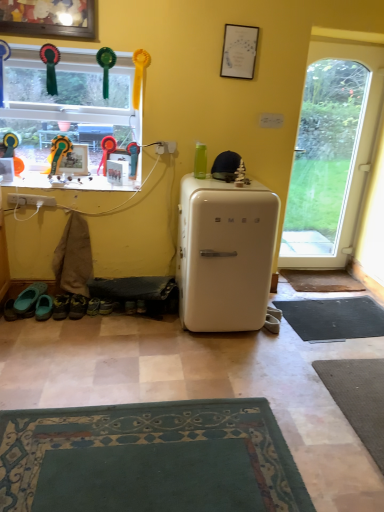
Question: Considering the relative positions of rubberized plastic toy at upper center, the 3th toy viewed from the left, and rubber ribbon at upper left, which ranks as the second toy in left-to-right order, in the image provided, is rubberized plastic toy at upper center, the 3th toy viewed from the left, to the left of rubber ribbon at upper left, which ranks as the second toy in left-to-right order, from the viewer's perspective?

Choices:
 (A) yes
 (B) no

Answer: (B)

Question: Is rubberized plastic toy at upper center, which is the first toy in right-to-left order, directly adjacent to rubber ribbon at upper left, the 2th toy in the right-to-left sequence?

Choices:
 (A) no
 (B) yes

Answer: (A)

Question: Is the position of rubberized plastic toy at upper center, the 3th toy viewed from the left, more distant than that of rubber ribbon at upper left, which ranks as the second toy in left-to-right order?

Choices:
 (A) no
 (B) yes

Answer: (A)

Question: Can rubber ribbon at upper left, which ranks as the second toy in left-to-right order, be found inside rubberized plastic toy at upper center, the 3th toy viewed from the left?

Choices:
 (A) no
 (B) yes

Answer: (A)

Question: Considering the relative sizes of rubberized plastic toy at upper center, which is the first toy in right-to-left order, and rubber ribbon at upper left, the 2th toy in the right-to-left sequence, in the image provided, is rubberized plastic toy at upper center, which is the first toy in right-to-left order, wider than rubber ribbon at upper left, the 2th toy in the right-to-left sequence,?

Choices:
 (A) no
 (B) yes

Answer: (B)

Question: Is rubberized plastic toy at upper center, which is the first toy in right-to-left order, oriented away from rubber ribbon at upper left, the 2th toy in the right-to-left sequence?

Choices:
 (A) no
 (B) yes

Answer: (A)

Question: Can you confirm if white matte refrigerator at center is thinner than teal fabric shoes at lower left, which is counted as the second footwear, starting from the right?

Choices:
 (A) no
 (B) yes

Answer: (A)

Question: From a real-world perspective, is white matte refrigerator at center under teal fabric shoes at lower left, arranged as the second footwear when viewed from the left?

Choices:
 (A) yes
 (B) no

Answer: (B)

Question: Is white matte refrigerator at center positioned behind teal fabric shoes at lower left, arranged as the second footwear when viewed from the left?

Choices:
 (A) yes
 (B) no

Answer: (B)

Question: From the image's perspective, is white matte refrigerator at center over teal fabric shoes at lower left, which is counted as the second footwear, starting from the right?

Choices:
 (A) no
 (B) yes

Answer: (B)

Question: Is white matte refrigerator at center turned away from teal fabric shoes at lower left, which is counted as the second footwear, starting from the right?

Choices:
 (A) yes
 (B) no

Answer: (B)

Question: Is white matte refrigerator at center in front of teal fabric shoes at lower left, arranged as the second footwear when viewed from the left?

Choices:
 (A) yes
 (B) no

Answer: (A)

Question: From a real-world perspective, is black rubber doormat at lower right over teal fabric shoes at lower left, arranged as the second footwear when viewed from the left?

Choices:
 (A) no
 (B) yes

Answer: (A)